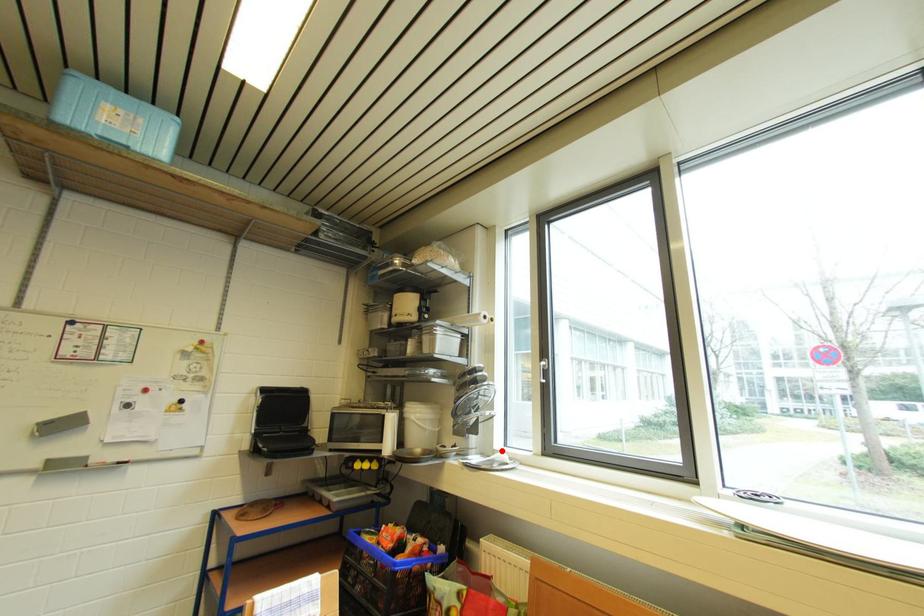
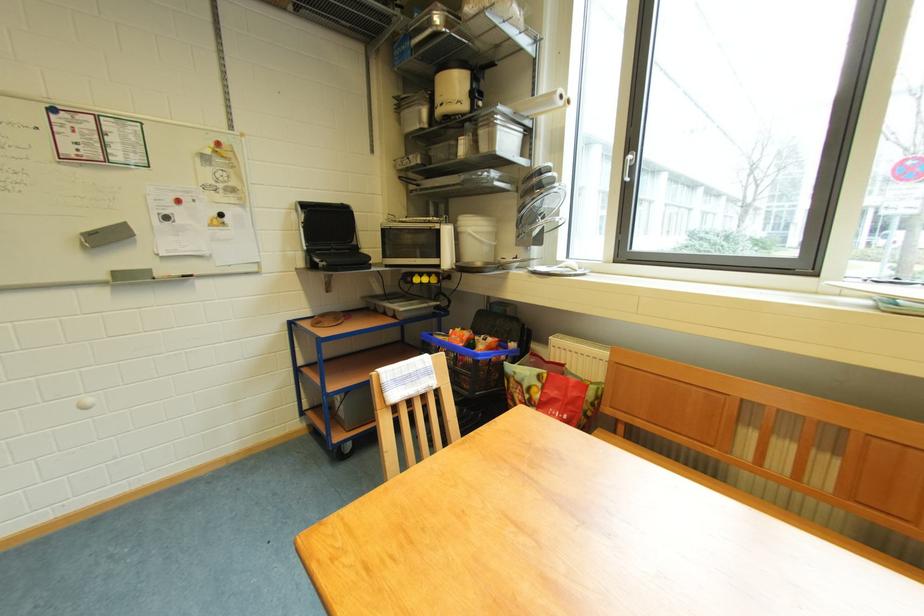
Locate, in the second image, the point that corresponds to the highlighted location in the first image.

(565, 262)